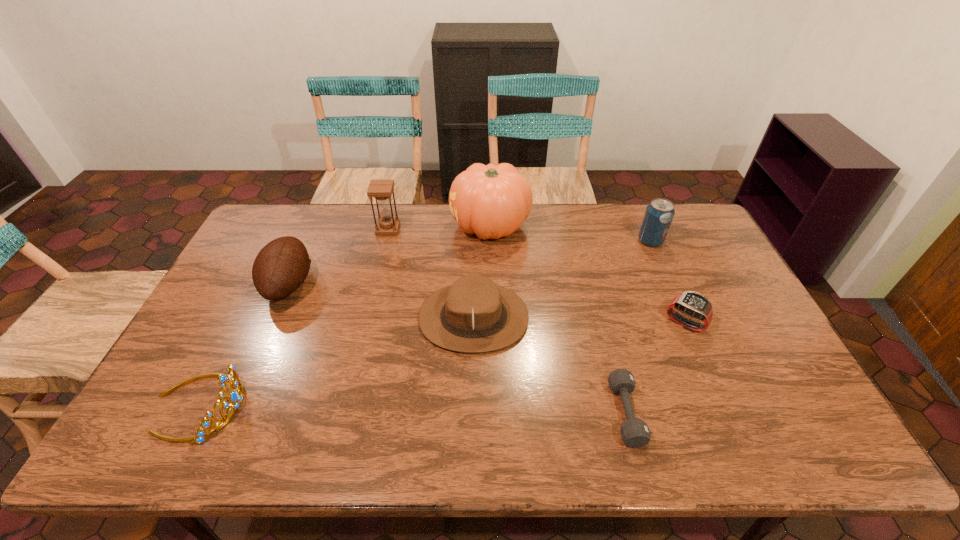
At what (x,y) coordinates should I click in order to perform the action: click on vacant space located on the carved face of the pumpkin. Please return your answer as a coordinate pair (x, y). The image size is (960, 540). Looking at the image, I should click on (378, 226).

This screenshot has width=960, height=540. Find the location of `vacant space situated 0.400m on the carved face of the pumpkin`. vacant space situated 0.400m on the carved face of the pumpkin is located at coordinates (340, 226).

The height and width of the screenshot is (540, 960). Identify the location of free region located on the left of the sixth object from right to left. (358, 229).

Identify the location of vacant space situated 0.190m on the left of the pop soda. click(583, 241).

The image size is (960, 540). Find the location of `free space located 0.070m on the laces of the football`. free space located 0.070m on the laces of the football is located at coordinates (336, 285).

Locate an element on the screen. free space located on the feather side of the fedora is located at coordinates (569, 318).

The height and width of the screenshot is (540, 960). I want to click on vacant region located on the front-facing side of the tiara, so click(x=398, y=405).

This screenshot has height=540, width=960. I want to click on free spot located 0.240m on the left of the seventh tallest object, so click(x=582, y=323).

Where is `vacant space located 0.350m on the back of the third object from right to left`? vacant space located 0.350m on the back of the third object from right to left is located at coordinates (592, 285).

You are a GUI agent. You are given a task and a screenshot of the screen. Output one action in this format:
    pyautogui.click(x=<x>, y=<y>)
    Task: Click on the pumpkin located in the far edge section of the desktop
    This screenshot has width=960, height=540.
    Given the screenshot: What is the action you would take?
    pyautogui.click(x=492, y=201)